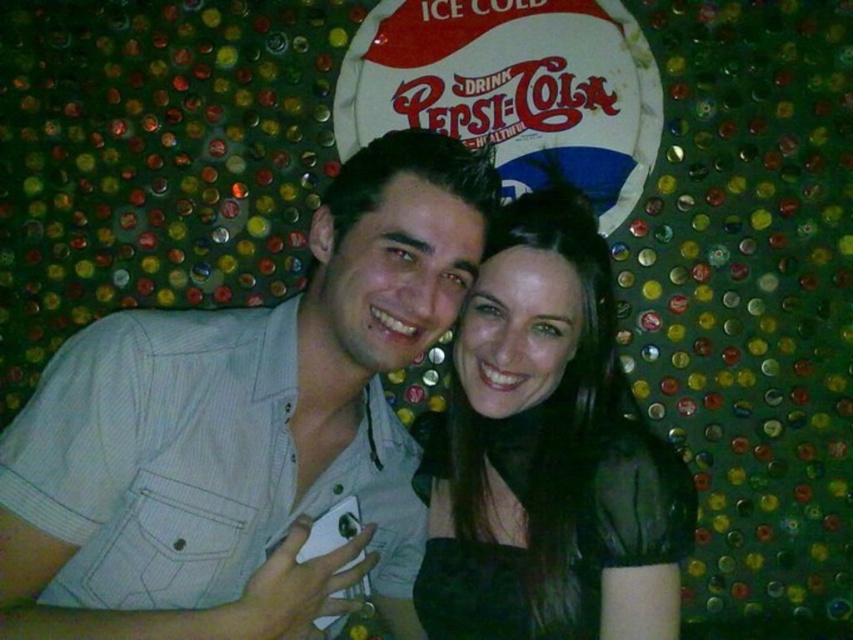
You are a photographer trying to capture a clear shot of both the light gray striped shirt at center and the black sheer top at center. Since they are positioned close to each other, you need to adjust your focus. Which shirt should you focus on first if you want to ensure the one on the left is sharp?

The light gray striped shirt at center is to the left of the black sheer top at center, so you should focus on the light gray striped shirt at center first to ensure it is sharp.

You are a fashion designer observing two tops in an image. The tops are the light gray striped shirt at center and the black sheer top at center. Which one is positioned lower on the body?

The light gray striped shirt at center is below the black sheer top at center, so the light gray striped shirt at center is positioned lower on the body.

You are a photographer standing 40 inches away from the light gray striped shirt at center. Can you adjust your position to get a closer shot without moving the shirt?

The light gray striped shirt at center is currently 33.94 inches away from the camera. Since you are standing 40 inches away, you need to move 6.06 inches closer to the shirt to capture a closer shot without moving it.